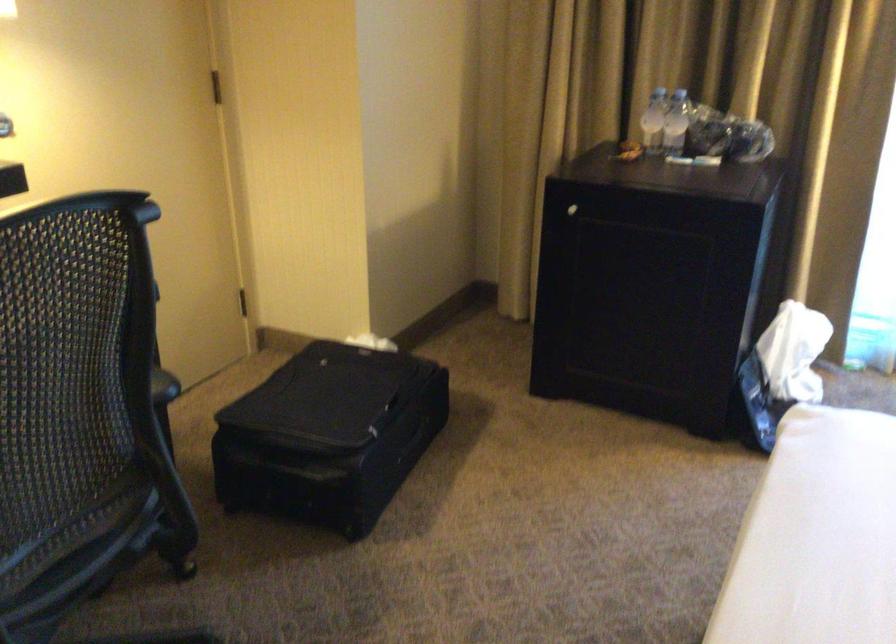
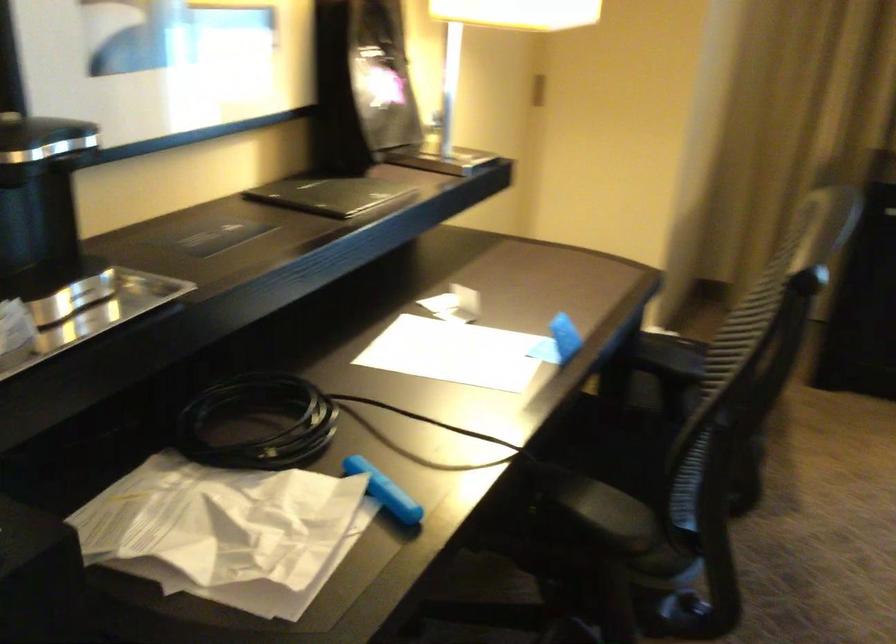
Question: What movement of the cameraman would produce the second image?

Choices:
 (A) Left
 (B) Right
 (C) Forward
 (D) Backward

Answer: (A)